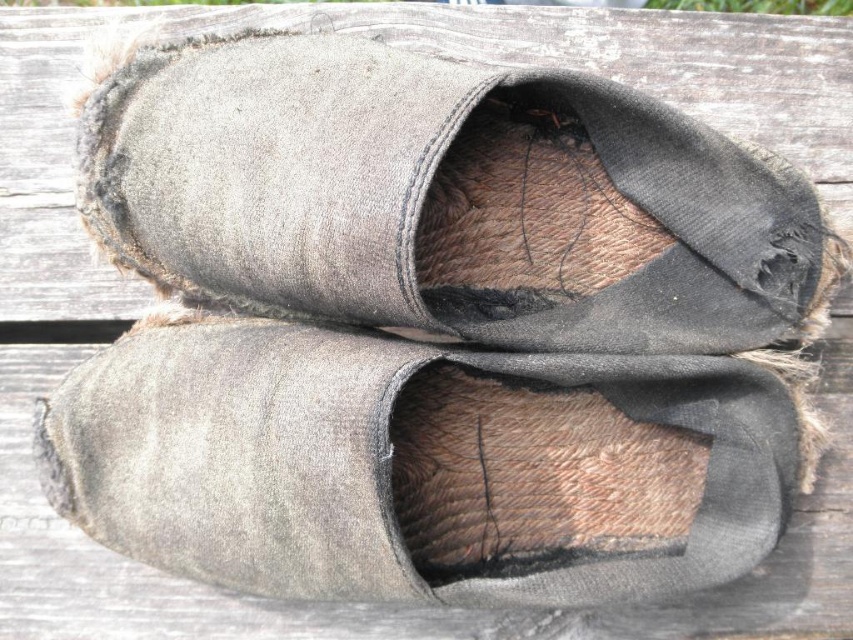
You are a shoemaker examining the fuzzy suede slipper at center and the gray suede shoe at center. Which one has a larger size?

The fuzzy suede slipper at center is bigger than the gray suede shoe at center.

You are trying to determine which item is wider between the fuzzy suede slipper at center and the gray suede shoe at center. Which one is wider?

The gray suede shoe at center is wider than the fuzzy suede slipper at center according to the description provided.

Consider the image. You are standing in a room and see two items on the wooden surface. The fuzzy suede slipper at center and the gray suede shoe at center. Which one is closer to you?

The fuzzy suede slipper at center is closer to you because it is in front of the gray suede shoe at center.